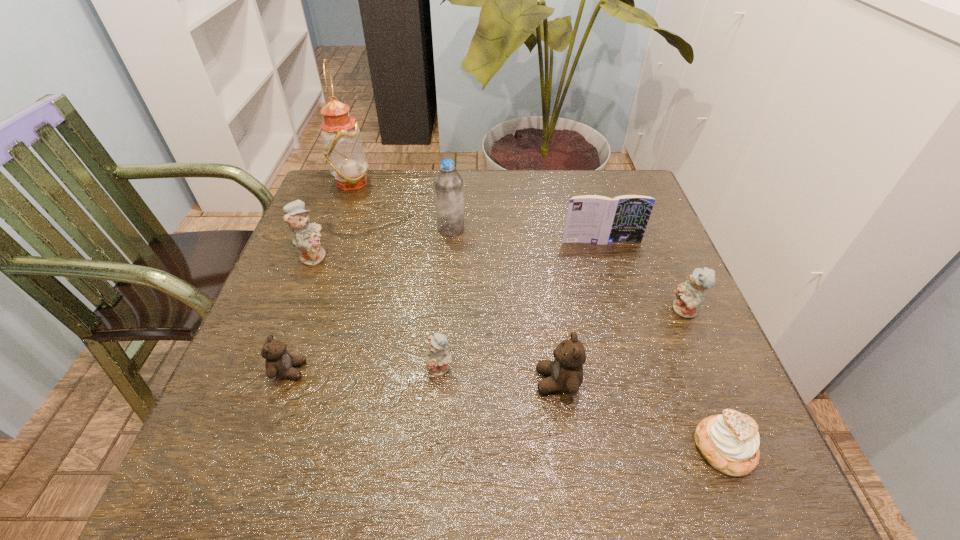
Where is `vacant space that's between the third teddy bear from left to right and the farthest object`? vacant space that's between the third teddy bear from left to right and the farthest object is located at coordinates (396, 275).

Locate an element on the screen. This screenshot has height=540, width=960. vacant region between the fifth farthest object and the book is located at coordinates (643, 276).

Find the location of a particular element. This screenshot has width=960, height=540. object that is the fourth closest to the second biggest blue teddy bear is located at coordinates (437, 361).

Identify the location of object that ranks as the second closest to the book. This screenshot has width=960, height=540. (449, 198).

The image size is (960, 540). Find the location of `teddy bear that stands as the fourth closest to the second biggest blue teddy bear`. teddy bear that stands as the fourth closest to the second biggest blue teddy bear is located at coordinates (306, 235).

Locate which teddy bear ranks fourth in proximity to the oil lamp. Please provide its 2D coordinates. Your answer should be formatted as a tuple, i.e. [(x, y)], where the tuple contains the x and y coordinates of a point satisfying the conditions above.

[(566, 372)]

Image resolution: width=960 pixels, height=540 pixels. What are the coordinates of `blue teddy bear that stands as the second closest to the nearest object` in the screenshot? It's located at (437, 361).

Select which blue teddy bear appears as the closest to the fifth nearest object. Please provide its 2D coordinates. Your answer should be formatted as a tuple, i.e. [(x, y)], where the tuple contains the x and y coordinates of a point satisfying the conditions above.

[(437, 361)]

What are the coordinates of `blank area in the image that satisfies the following two spatial constraints: 1. on the front-facing side of the rightmost blue teddy bear; 2. on the front-facing side of the second blue teddy bear from right to left` in the screenshot? It's located at (709, 368).

The width and height of the screenshot is (960, 540). What are the coordinates of `free point that satisfies the following two spatial constraints: 1. on the front-facing side of the nearest object; 2. on the left side of the farthest teddy bear` in the screenshot? It's located at (237, 448).